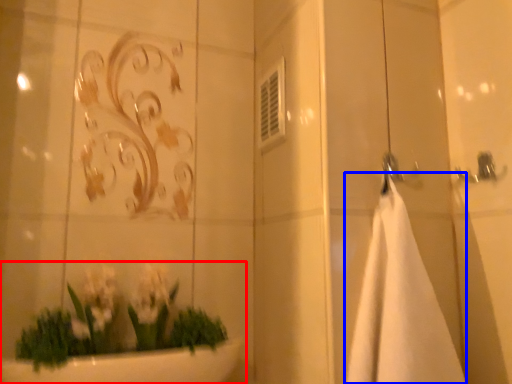
Question: Which object appears closest to the camera in this image, houseplant (highlighted by a red box) or bath towel (highlighted by a blue box)?

Choices:
 (A) houseplant
 (B) bath towel

Answer: (B)